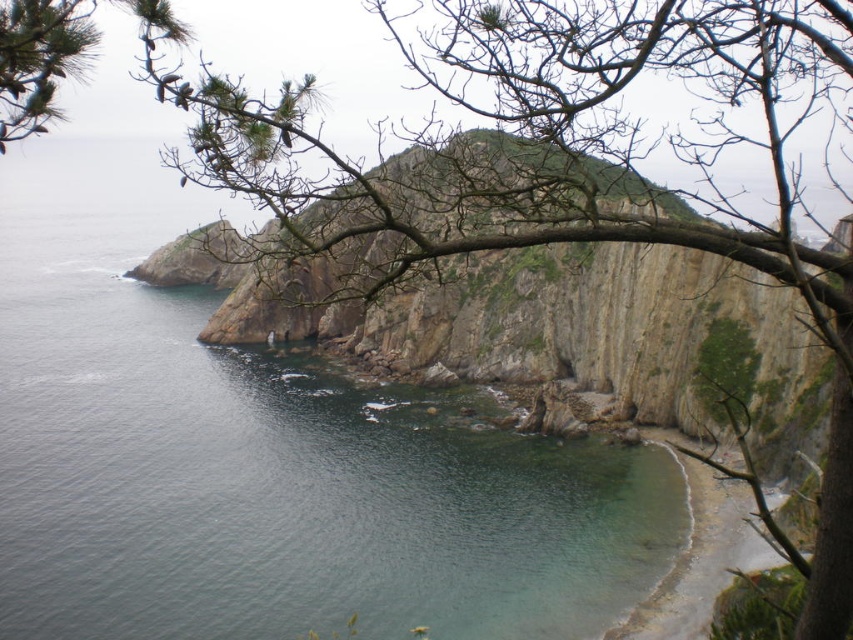
Question: Which point is farther to the camera?

Choices:
 (A) clear sand beach at lower right
 (B) clear water at center

Answer: (B)

Question: Can you confirm if clear water at center is positioned below clear sand beach at lower right?

Choices:
 (A) no
 (B) yes

Answer: (A)

Question: Is clear water at center to the left of clear sand beach at lower right from the viewer's perspective?

Choices:
 (A) no
 (B) yes

Answer: (B)

Question: Can you confirm if clear water at center is thinner than clear sand beach at lower right?

Choices:
 (A) no
 (B) yes

Answer: (A)

Question: Among these objects, which one is nearest to the camera?

Choices:
 (A) clear sand beach at lower right
 (B) clear water at center

Answer: (A)